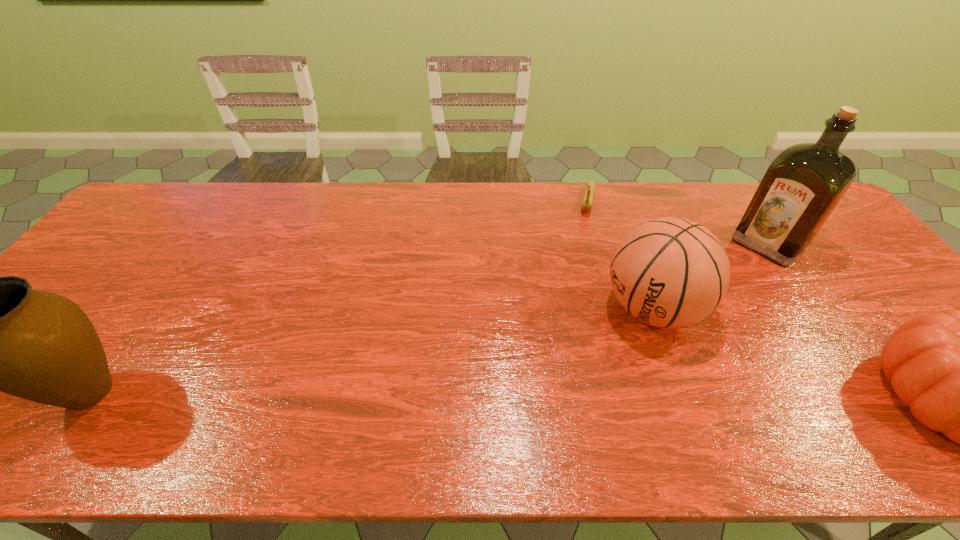
This screenshot has width=960, height=540. Find the location of `object located in the right edge section of the desktop`. object located in the right edge section of the desktop is located at coordinates (802, 186).

Locate an element on the screen. The width and height of the screenshot is (960, 540). object at the near left corner is located at coordinates (0, 334).

At what (x,y) coordinates should I click in order to perform the action: click on object at the far right corner. Please return your answer as a coordinate pair (x, y). This screenshot has width=960, height=540. Looking at the image, I should click on (802, 186).

I want to click on blank space at the far edge of the desktop, so click(x=213, y=196).

Locate an element on the screen. This screenshot has height=540, width=960. vacant space at the near edge of the desktop is located at coordinates (590, 395).

The width and height of the screenshot is (960, 540). Find the location of `free space at the right edge of the desktop`. free space at the right edge of the desktop is located at coordinates (854, 308).

Where is `unoccupied area between the urn and the basketball`? Image resolution: width=960 pixels, height=540 pixels. unoccupied area between the urn and the basketball is located at coordinates (372, 350).

The width and height of the screenshot is (960, 540). In order to click on object that stands as the second closest to the shortest object in this screenshot , I will do `click(802, 186)`.

Find the location of a particular element. object that is the third closest one to the leftmost object is located at coordinates (802, 186).